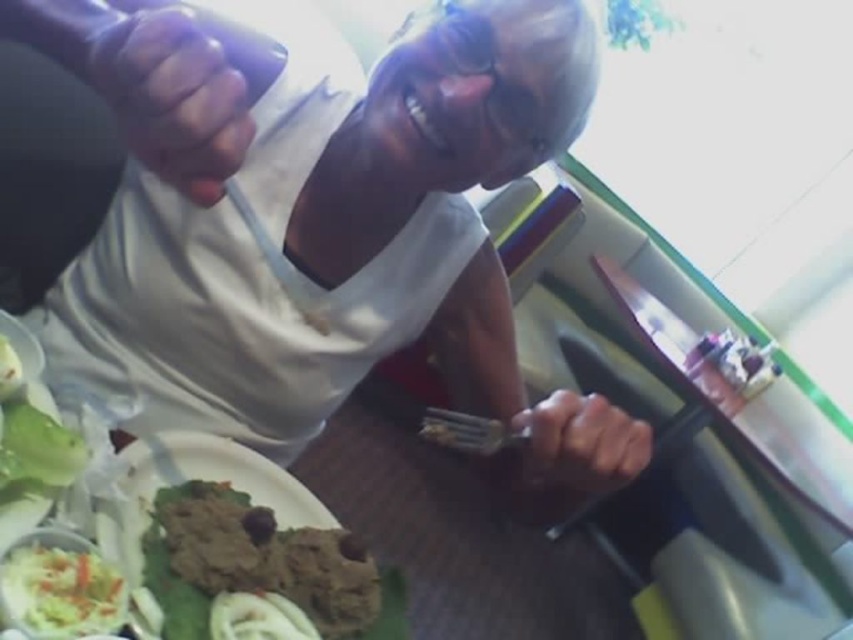
Question: Does smooth skin hand at center lie in front of smooth skin hand at lower center?

Choices:
 (A) yes
 (B) no

Answer: (A)

Question: Is shredded white cabbage at lower left above metallic silver fork at lower center?

Choices:
 (A) no
 (B) yes

Answer: (A)

Question: Estimate the real-world distances between objects in this image. Which object is farther from the wooden table at center?

Choices:
 (A) smooth skin hand at lower center
 (B) shredded white cabbage at lower left
 (C) metallic silver fork at lower center
 (D) white matte shirt at upper center

Answer: (B)

Question: Which object appears closest to the camera in this image?

Choices:
 (A) brown matte food at lower left
 (B) white matte shirt at upper center
 (C) smooth skin hand at lower center

Answer: (B)

Question: Which object is closer to the camera taking this photo?

Choices:
 (A) brown matte food at lower left
 (B) smooth skin hand at lower center

Answer: (A)

Question: Is wooden table at center to the left of smooth skin hand at lower center from the viewer's perspective?

Choices:
 (A) yes
 (B) no

Answer: (B)